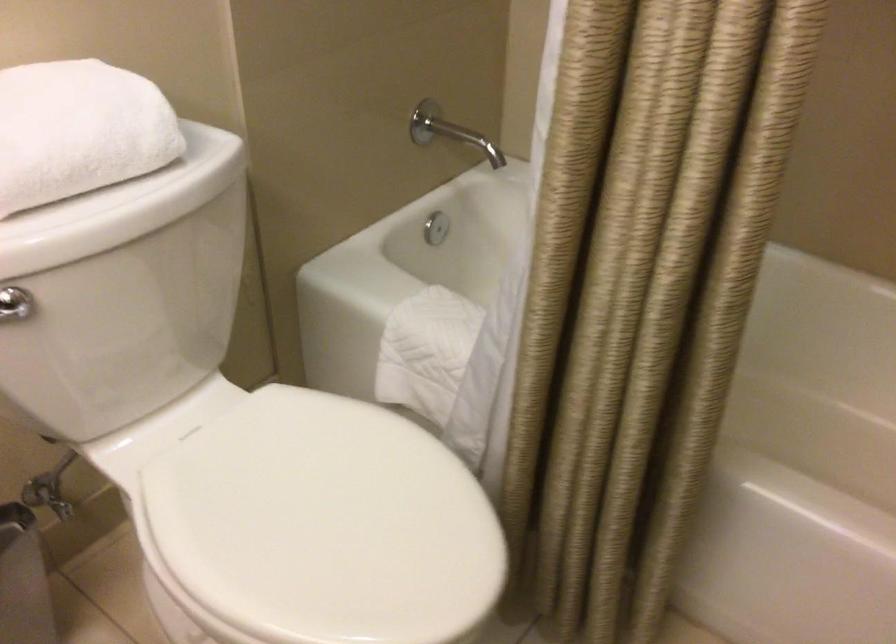
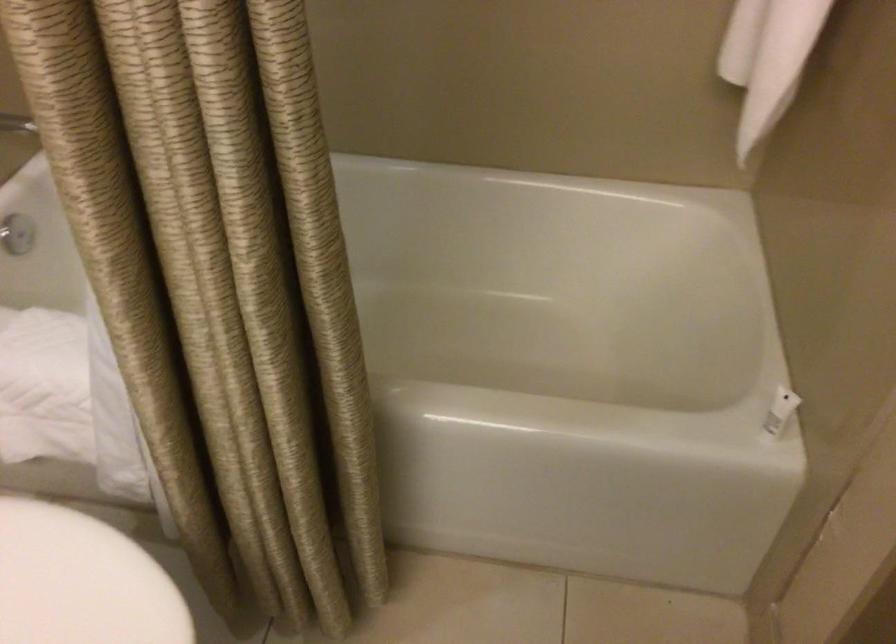
Question: The camera is either moving clockwise (left) or counter-clockwise (right) around the object. The first image is from the beginning of the video and the second image is from the end. Is the camera moving left or right when shooting the video?

Choices:
 (A) Left
 (B) Right

Answer: (A)